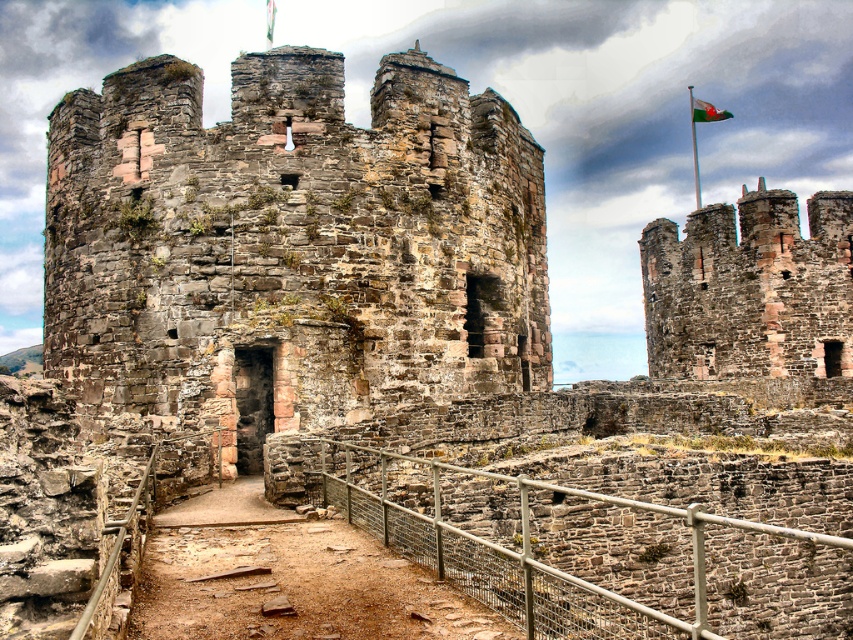
Question: Does rusty stone castle at center appear on the left side of rustic stone wall at upper right?

Choices:
 (A) no
 (B) yes

Answer: (B)

Question: Can you confirm if rusty stone castle at center is smaller than green fabric flag at upper right?

Choices:
 (A) no
 (B) yes

Answer: (A)

Question: Which point appears farthest from the camera in this image?

Choices:
 (A) (706, 115)
 (B) (753, 198)
 (C) (321, 145)

Answer: (A)

Question: Which of the following is the farthest from the observer?

Choices:
 (A) rusty stone castle at center
 (B) rustic stone wall at upper right

Answer: (B)

Question: Which of the following is the farthest from the observer?

Choices:
 (A) green fabric flag at upper right
 (B) rustic stone wall at upper right
 (C) rusty stone castle at center

Answer: (A)

Question: Can you confirm if rusty stone castle at center is bigger than green fabric flag at upper right?

Choices:
 (A) yes
 (B) no

Answer: (A)